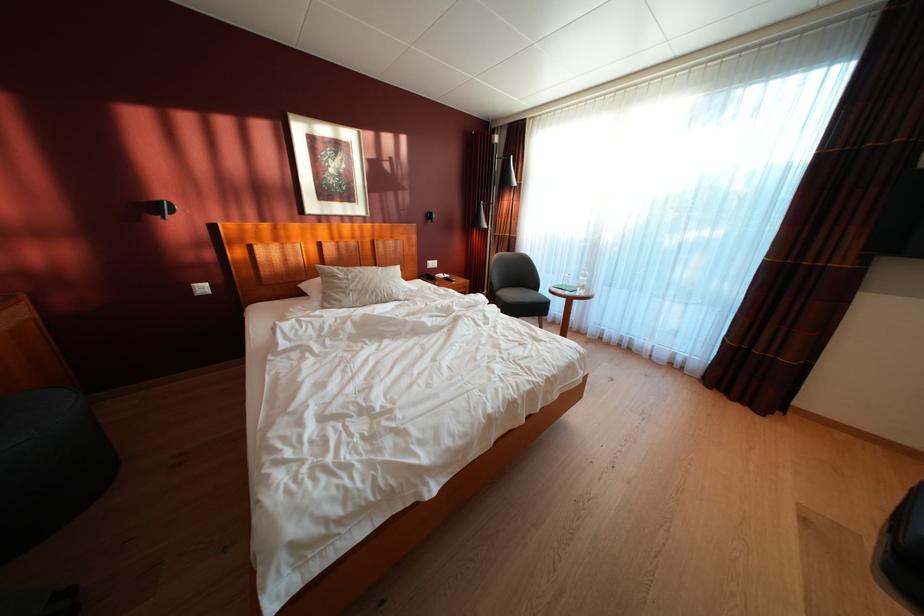
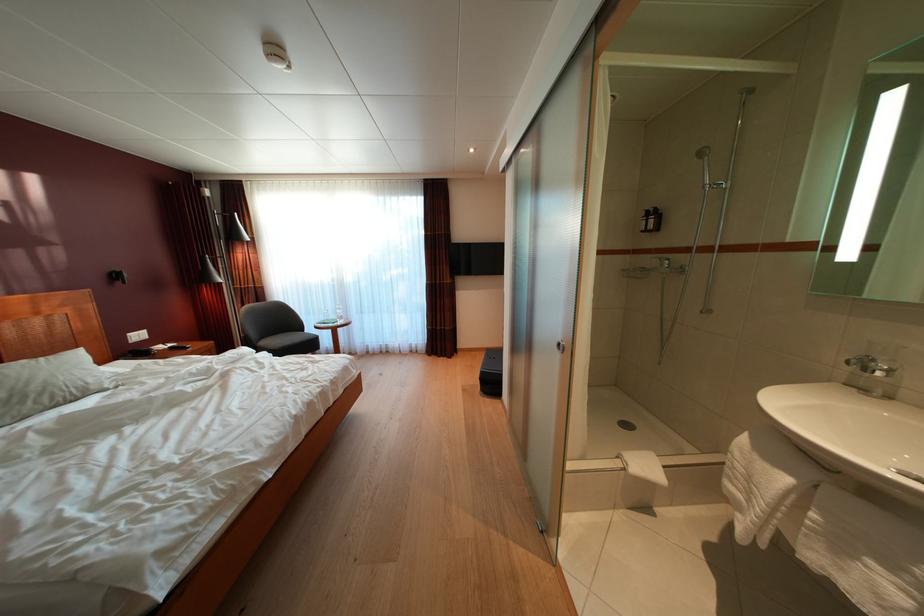
The point at (368, 293) is marked in the first image. Where is the corresponding point in the second image?

(10, 400)